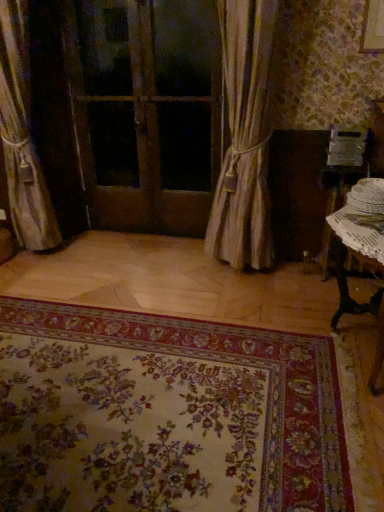
Question: Is white wicker table at lower right, the second table from the back, taller than wooden door at center?

Choices:
 (A) no
 (B) yes

Answer: (A)

Question: Does white wicker table at lower right, the second table from the back, have a lesser width compared to wooden door at center?

Choices:
 (A) no
 (B) yes

Answer: (A)

Question: Is white wicker table at lower right, the second table from the back, wider than wooden door at center?

Choices:
 (A) yes
 (B) no

Answer: (A)

Question: Could you tell me if white wicker table at lower right, the second table from the back, is turned towards wooden door at center?

Choices:
 (A) no
 (B) yes

Answer: (A)

Question: Can wooden door at center be found inside white wicker table at lower right, the second table from the back?

Choices:
 (A) yes
 (B) no

Answer: (B)

Question: Considering the relative positions of white wicker table at lower right, the second table from the back, and wooden door at center in the image provided, is white wicker table at lower right, the second table from the back, to the left of wooden door at center from the viewer's perspective?

Choices:
 (A) yes
 (B) no

Answer: (B)

Question: Can you confirm if white wicker table at lower right, the second table from the back, is taller than silky beige curtain at center, which is the first curtain from right to left?

Choices:
 (A) yes
 (B) no

Answer: (B)

Question: Considering the relative sizes of white wicker table at lower right, the second table from the back, and silky beige curtain at center, positioned as the 2th curtain in left-to-right order, in the image provided, is white wicker table at lower right, the second table from the back, shorter than silky beige curtain at center, positioned as the 2th curtain in left-to-right order,?

Choices:
 (A) yes
 (B) no

Answer: (A)

Question: From a real-world perspective, is white wicker table at lower right, the second table from the back, located beneath silky beige curtain at center, which is the first curtain from right to left?

Choices:
 (A) yes
 (B) no

Answer: (A)

Question: Is white wicker table at lower right, which appears as the first table when viewed from the front, positioned with its back to silky beige curtain at center, which is the first curtain from right to left?

Choices:
 (A) yes
 (B) no

Answer: (B)

Question: Can you confirm if white wicker table at lower right, which appears as the first table when viewed from the front, is thinner than silky beige curtain at center, which is the first curtain from right to left?

Choices:
 (A) yes
 (B) no

Answer: (B)

Question: Is white wicker table at lower right, the second table from the back, not within silky beige curtain at center, positioned as the 2th curtain in left-to-right order?

Choices:
 (A) no
 (B) yes

Answer: (B)

Question: Can you confirm if silky beige curtain at left, which appears as the second curtain when viewed from the right, is positioned to the left of silky beige curtain at center, positioned as the 2th curtain in left-to-right order?

Choices:
 (A) yes
 (B) no

Answer: (A)